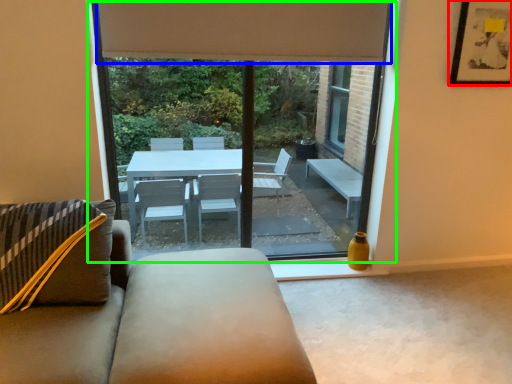
Question: Considering the real-world distances, which object is farthest from picture frame (highlighted by a red box)? curtain (highlighted by a blue box) or window (highlighted by a green box)?

Choices:
 (A) curtain
 (B) window

Answer: (B)